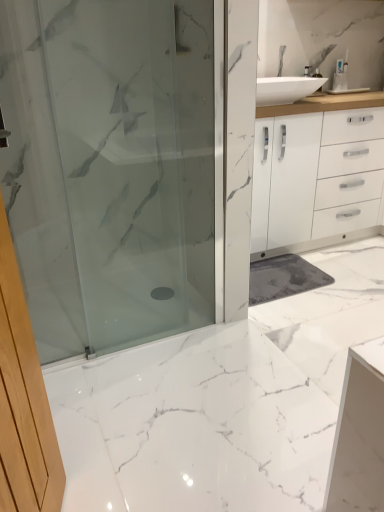
You are a GUI agent. You are given a task and a screenshot of the screen. Output one action in this format:
    pyautogui.click(x=<x>, y=<y>)
    Task: Click on the vacant space positioned to the left of satin glass shower door at center
    This screenshot has width=384, height=512.
    Given the screenshot: What is the action you would take?
    pyautogui.click(x=97, y=335)